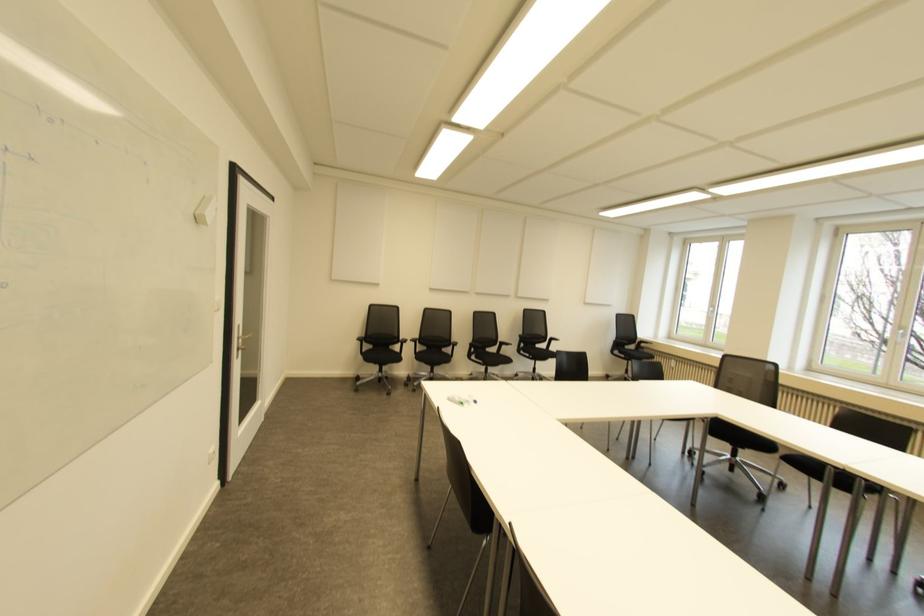
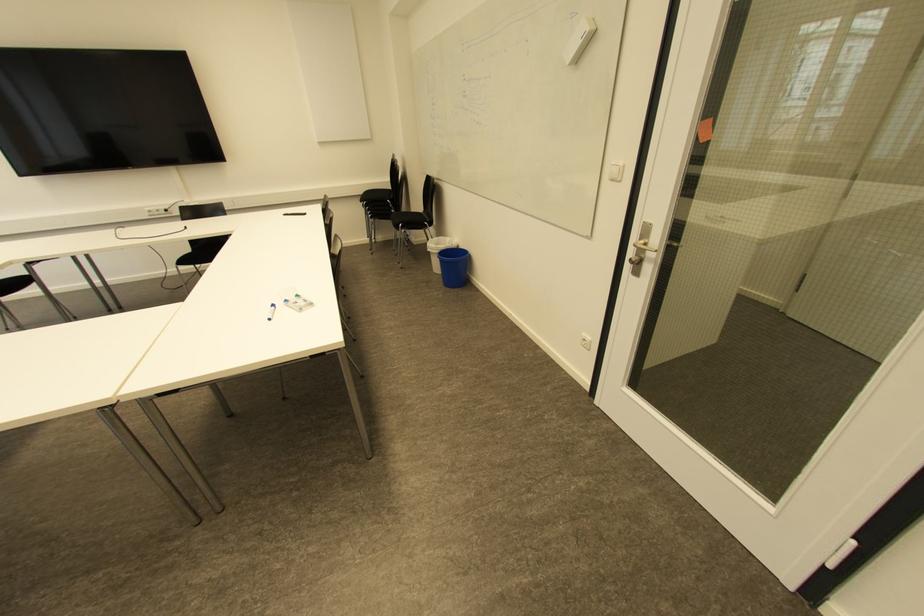
In the second image, find the point that corresponds to pixel 475 400 in the first image.

(273, 306)